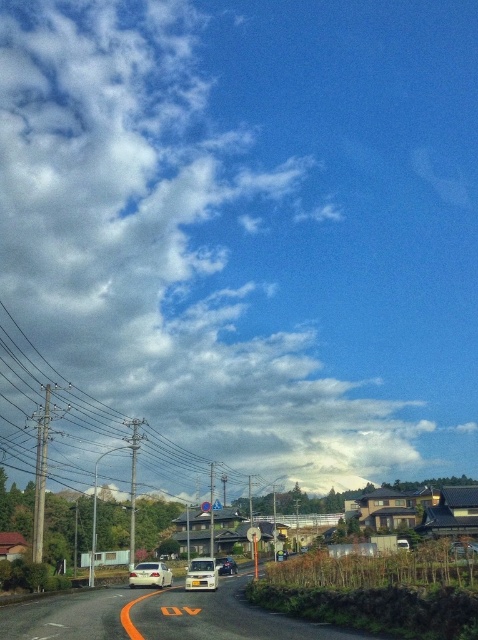
Who is more forward, (158, 580) or (218, 570)?

Point (158, 580) is in front.

Is point (144, 573) closer to viewer compared to point (230, 572)?

That is True.

Locate an element on the screen. The image size is (478, 640). white matte car at lower left is located at coordinates (151, 573).

Can you confirm if white matte car at lower left is bigger than white matte van at center?

Incorrect, white matte car at lower left is not larger than white matte van at center.

Is point (171, 584) in front of point (208, 586)?

No, it is not.

At what (x,y) coordinates should I click in order to perform the action: click on white matte car at lower left. Please return your answer as a coordinate pair (x, y). Looking at the image, I should click on (151, 573).

Is point (232, 474) less distant than point (158, 580)?

No.

Can you confirm if metallic wire at left is positioned to the right of white matte car at lower left?

In fact, metallic wire at left is to the left of white matte car at lower left.

Looking at this image, who is more forward, (80, 483) or (171, 582)?

Point (171, 582) is in front.

The image size is (478, 640). Identify the location of metallic wire at left. click(52, 410).